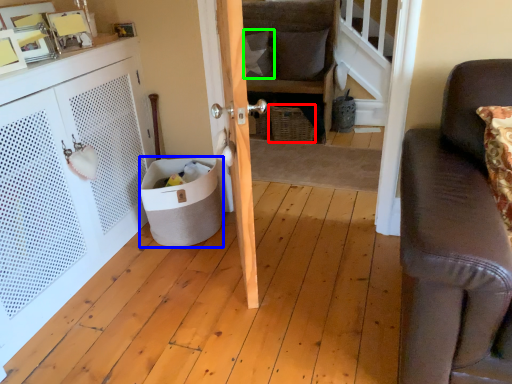
Question: Estimate the real-world distances between objects in this image. Which object is closer to basket (highlighted by a red box), trash bin/can (highlighted by a blue box) or pillow (highlighted by a green box)?

Choices:
 (A) trash bin/can
 (B) pillow

Answer: (B)